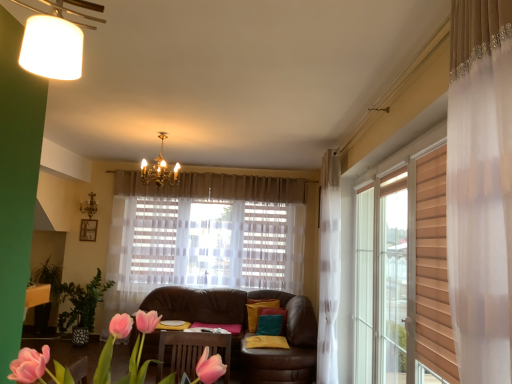
Question: Is point (295, 306) positioned closer to the camera than point (59, 365)?

Choices:
 (A) farther
 (B) closer

Answer: (A)

Question: Considering the positions of brown leather couch at center and pink fabric flowers at lower left in the image, is brown leather couch at center wider or thinner than pink fabric flowers at lower left?

Choices:
 (A) thin
 (B) wide

Answer: (A)

Question: From a real-world perspective, is brown leather couch at center above or below pink fabric flowers at lower left?

Choices:
 (A) above
 (B) below

Answer: (B)

Question: From a real-world perspective, is pink fabric flowers at lower left positioned above or below brown leather couch at center?

Choices:
 (A) below
 (B) above

Answer: (B)

Question: Considering their positions, is pink fabric flowers at lower left located in front of or behind brown leather couch at center?

Choices:
 (A) behind
 (B) front

Answer: (B)

Question: Considering the relative positions of pink fabric flowers at lower left and brown leather couch at center in the image provided, is pink fabric flowers at lower left to the left or to the right of brown leather couch at center?

Choices:
 (A) right
 (B) left

Answer: (B)

Question: Is pink fabric flowers at lower left inside the boundaries of brown leather couch at center, or outside?

Choices:
 (A) outside
 (B) inside

Answer: (A)